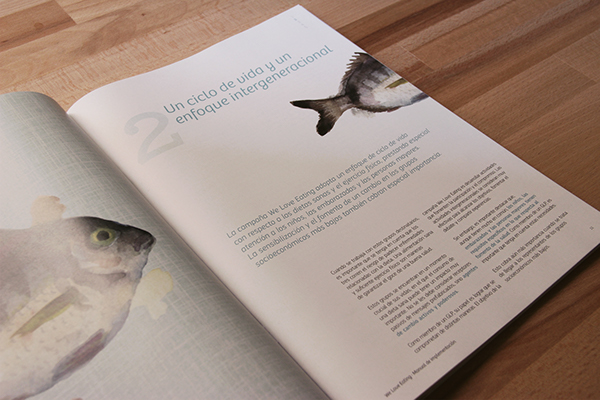
The width and height of the screenshot is (600, 400). Identify the location of book. (196, 247).